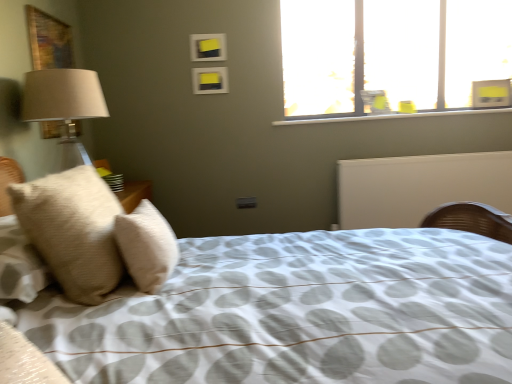
Find the location of a particular element. This screenshot has width=512, height=384. white textured bed at center is located at coordinates (297, 313).

What do you see at coordinates (208, 47) in the screenshot? I see `matte black picture frame at upper center, marked as the first picture frame in a top-to-bottom arrangement` at bounding box center [208, 47].

Measure the distance between point (220,88) and camera.

The depth of point (220,88) is 3.08 meters.

You are a GUI agent. You are given a task and a screenshot of the screen. Output one action in this format:
    pyautogui.click(x=<x>, y=<y>)
    Task: Click on the transparent glass window at upper right
    
    Given the screenshot: What is the action you would take?
    pyautogui.click(x=392, y=55)

Is yellow matte picture frame at upper center, which is the 2th picture frame in top-to-bottom order, further to camera compared to transparent glass window at upper right?

No.

From the picture: Which of these two, yellow matte picture frame at upper center, which is counted as the 1th picture frame, starting from the bottom, or transparent glass window at upper right, stands shorter?

yellow matte picture frame at upper center, which is counted as the 1th picture frame, starting from the bottom.

From the image's perspective, which picture frame is the 2nd one below the transparent glass window at upper right? Please provide its 2D coordinates.

[(210, 80)]

Is transparent glass window at upper right inside yellow matte picture frame at upper center, which is the 2th picture frame in top-to-bottom order?

No.

Considering the sizes of white textured bed at center and transparent glass window at upper right in the image, is white textured bed at center bigger or smaller than transparent glass window at upper right?

white textured bed at center is bigger than transparent glass window at upper right.

From a real-world perspective, is white textured bed at center above or below transparent glass window at upper right?

From a real-world perspective, white textured bed at center is physically below transparent glass window at upper right.

Is white textured bed at center wider or thinner than transparent glass window at upper right?

In the image, white textured bed at center appears to be wider than transparent glass window at upper right.

Considering the relative positions of white textured bed at center and transparent glass window at upper right in the image provided, is white textured bed at center to the right of transparent glass window at upper right from the viewer's perspective?

No, white textured bed at center is not to the right of transparent glass window at upper right.

Can you tell me how much beige soft pillow at left, which is the 2th pillow from left to right, and matte black picture frame at upper center, the 2th picture frame in the bottom-to-top sequence, differ in facing direction?

87.9 degrees.

Which of these two, beige soft pillow at left, which is the 2th pillow from left to right, or matte black picture frame at upper center, the 2th picture frame in the bottom-to-top sequence, is thinner?

Thinner between the two is matte black picture frame at upper center, the 2th picture frame in the bottom-to-top sequence.

How much distance is there between beige soft pillow at left, arranged as the 1th pillow when viewed from the right, and matte black picture frame at upper center, marked as the first picture frame in a top-to-bottom arrangement?

beige soft pillow at left, arranged as the 1th pillow when viewed from the right, is 6.35 feet from matte black picture frame at upper center, marked as the first picture frame in a top-to-bottom arrangement.

Which is more to the left, beige soft pillow at left, arranged as the 1th pillow when viewed from the right, or matte black picture frame at upper center, the 2th picture frame in the bottom-to-top sequence?

beige soft pillow at left, arranged as the 1th pillow when viewed from the right.

Could you measure the distance between beige textured pillow at left, which is the 1th pillow from left to right, and matte black picture frame at upper center, the 2th picture frame in the bottom-to-top sequence?

beige textured pillow at left, which is the 1th pillow from left to right, is 6.54 feet from matte black picture frame at upper center, the 2th picture frame in the bottom-to-top sequence.

From the image's perspective, is beige textured pillow at left, which is the 1th pillow from left to right, below matte black picture frame at upper center, marked as the first picture frame in a top-to-bottom arrangement?

Indeed, from the image's perspective, beige textured pillow at left, which is the 1th pillow from left to right, is shown beneath matte black picture frame at upper center, marked as the first picture frame in a top-to-bottom arrangement.

Is matte black picture frame at upper center, the 2th picture frame in the bottom-to-top sequence, surrounded by beige textured pillow at left, which is the 1th pillow from left to right?

No, matte black picture frame at upper center, the 2th picture frame in the bottom-to-top sequence, is not inside beige textured pillow at left, which is the 1th pillow from left to right.

Which is farther from the camera, (58, 272) or (198, 45)?

A: Point (198, 45)

From the image's perspective, is white textured bed at center located beneath white matte radiator at center?

Correct, white textured bed at center appears lower than white matte radiator at center in the image.

The width and height of the screenshot is (512, 384). What are the coordinates of `radiator that appears above the white textured bed at center (from the image's perspective)` in the screenshot? It's located at (419, 187).

Is white textured bed at center looking in the opposite direction of white matte radiator at center?

white textured bed at center does not have its back to white matte radiator at center.

Is white textured bed at center positioned far away from white matte radiator at center?

Yes, white textured bed at center is far from white matte radiator at center.

Consider the image. From the image's perspective, is beige textured pillow at left, the 2th pillow positioned from the right, above or below beige soft pillow at left, which is the 2th pillow from left to right?

From the image's perspective, beige textured pillow at left, the 2th pillow positioned from the right, appears below beige soft pillow at left, which is the 2th pillow from left to right.

Could you tell me if beige textured pillow at left, the 2th pillow positioned from the right, is facing beige soft pillow at left, arranged as the 1th pillow when viewed from the right?

Yes, beige textured pillow at left, the 2th pillow positioned from the right, is facing beige soft pillow at left, arranged as the 1th pillow when viewed from the right.

From a real-world perspective, which is physically below, beige textured pillow at left, which is the 1th pillow from left to right, or beige soft pillow at left, arranged as the 1th pillow when viewed from the right?

beige textured pillow at left, which is the 1th pillow from left to right.

Do you think beige textured pillow at left, which is the 1th pillow from left to right, is within beige soft pillow at left, arranged as the 1th pillow when viewed from the right, or outside of it?

beige textured pillow at left, which is the 1th pillow from left to right, is located beyond the bounds of beige soft pillow at left, arranged as the 1th pillow when viewed from the right.

Is point (463, 86) closer to camera compared to point (396, 374)?

No, (463, 86) is further to viewer.

From the picture: Is transparent glass window at upper right not near white textured bed at center?

Yes, transparent glass window at upper right is far from white textured bed at center.

Is transparent glass window at upper right closer to the viewer compared to white textured bed at center?

No, it is behind white textured bed at center.

Is transparent glass window at upper right bigger than white textured bed at center?

Actually, transparent glass window at upper right might be smaller than white textured bed at center.

Find the location of a particular element. The height and width of the screenshot is (384, 512). window above the yellow matte picture frame at upper center, which is the 2th picture frame in top-to-bottom order (from the image's perspective) is located at coordinates (392, 55).

There is a white textured bed at center. Where is `window above it (from a real-world perspective)`? The image size is (512, 384). window above it (from a real-world perspective) is located at coordinates (392, 55).

Considering their positions, is matte black picture frame at upper center, marked as the first picture frame in a top-to-bottom arrangement, positioned closer to transparent glass window at upper right than beige soft pillow at left, arranged as the 1th pillow when viewed from the right?

The object closer to transparent glass window at upper right is matte black picture frame at upper center, marked as the first picture frame in a top-to-bottom arrangement.

Considering their positions, is beige textured pillow at left, the 2th pillow positioned from the right, positioned closer to beige soft pillow at left, which is the 2th pillow from left to right, than white matte radiator at center?

beige textured pillow at left, the 2th pillow positioned from the right, is closer to beige soft pillow at left, which is the 2th pillow from left to right.

Looking at the image, which one is located closer to yellow matte picture frame at upper center, which is counted as the 1th picture frame, starting from the bottom, white textured bed at center or beige soft pillow at left, which is the 2th pillow from left to right?

The object closer to yellow matte picture frame at upper center, which is counted as the 1th picture frame, starting from the bottom, is beige soft pillow at left, which is the 2th pillow from left to right.

Estimate the real-world distances between objects in this image. Which object is closer to yellow matte picture frame at upper center, which is counted as the 1th picture frame, starting from the bottom, beige textured pillow at left, which is the 1th pillow from left to right, or beige soft pillow at left, arranged as the 1th pillow when viewed from the right?

beige soft pillow at left, arranged as the 1th pillow when viewed from the right, lies closer to yellow matte picture frame at upper center, which is counted as the 1th picture frame, starting from the bottom, than the other object.

In the scene shown: Looking at the image, which one is located closer to transparent glass window at upper right, beige textured pillow at left, which is the 1th pillow from left to right, or white matte radiator at center?

white matte radiator at center lies closer to transparent glass window at upper right than the other object.

Looking at the image, which one is located further to transparent glass window at upper right, white textured bed at center or yellow matte picture frame at upper center, which is the 2th picture frame in top-to-bottom order?

white textured bed at center is further to transparent glass window at upper right.

Estimate the real-world distances between objects in this image. Which object is further from beige textured pillow at left, which is the 1th pillow from left to right, beige soft pillow at left, arranged as the 1th pillow when viewed from the right, or matte black picture frame at upper center, the 2th picture frame in the bottom-to-top sequence?

matte black picture frame at upper center, the 2th picture frame in the bottom-to-top sequence, is positioned further to the anchor beige textured pillow at left, which is the 1th pillow from left to right.

Which object lies further to the anchor point white textured bed at center, matte black picture frame at upper center, marked as the first picture frame in a top-to-bottom arrangement, or transparent glass window at upper right?

matte black picture frame at upper center, marked as the first picture frame in a top-to-bottom arrangement, is further to white textured bed at center.

Find the location of `pillow between beige textured pillow at left, which is the 1th pillow from left to right, and white matte radiator at center in the front-back direction`. pillow between beige textured pillow at left, which is the 1th pillow from left to right, and white matte radiator at center in the front-back direction is located at coordinates (147, 246).

Where is `picture frame between white textured bed at center and yellow matte picture frame at upper center, which is counted as the 1th picture frame, starting from the bottom, along the z-axis`? The width and height of the screenshot is (512, 384). picture frame between white textured bed at center and yellow matte picture frame at upper center, which is counted as the 1th picture frame, starting from the bottom, along the z-axis is located at coordinates (208, 47).

At what (x,y) coordinates should I click in order to perform the action: click on pillow between beige textured pillow at left, which is the 1th pillow from left to right, and yellow matte picture frame at upper center, which is the 2th picture frame in top-to-bottom order, from front to back. Please return your answer as a coordinate pair (x, y). This screenshot has height=384, width=512. Looking at the image, I should click on (147, 246).

Locate an element on the screen. picture frame between matte black picture frame at upper center, marked as the first picture frame in a top-to-bottom arrangement, and transparent glass window at upper right from left to right is located at coordinates (210, 80).